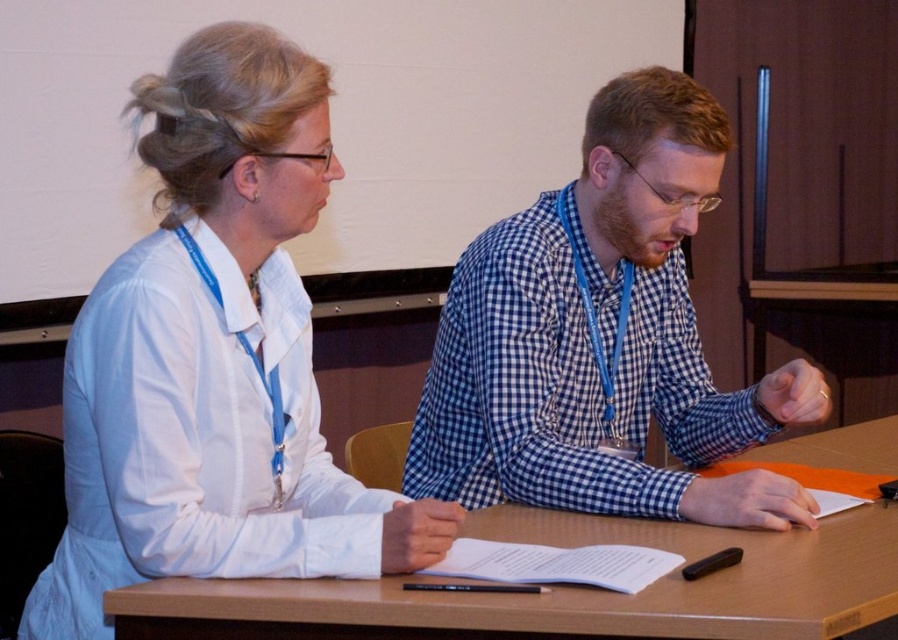
You are a delivery robot that needs to deliver a package to the person wearing the white smooth shirt at upper left. The robot has a width of 0.8 meters. Can you fit through the space between the two people sitting at the table?

The two individuals are 1.05 meters apart. Since the robot is 0.8 meters wide, it can fit through the space between them as the distance is greater than the robot width.

From the picture: You are organizing a meeting and need to place a 20 cm wide notebook between the blue checkered shirt at center and the wooden table at center. Can the notebook fit in the space between them?

The blue checkered shirt at center has a lesser width compared to wooden table at center, so the space between them is sufficient to place a 20 cm wide notebook.